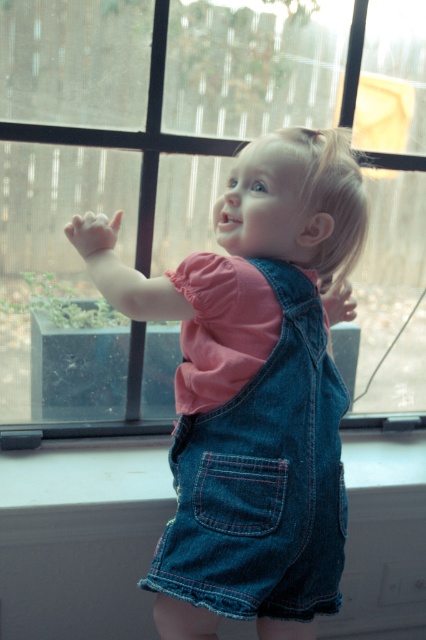
Between clear glass window at center and denim jacket at center, which one appears on the right side from the viewer's perspective?

clear glass window at center is more to the right.

Based on the photo, which of these two, clear glass window at center or denim jacket at center, stands taller?

Standing taller between the two is clear glass window at center.

Which is in front, point (423, 179) or point (244, 300)?

Point (244, 300) is in front.

Find the location of a particular element. Image resolution: width=426 pixels, height=640 pixels. clear glass window at center is located at coordinates (204, 129).

Who is positioned more to the right, denim overalls at center or denim jacket at center?

From the viewer's perspective, denim jacket at center appears more on the right side.

Can you confirm if denim overalls at center is smaller than denim jacket at center?

No, denim overalls at center is not smaller than denim jacket at center.

Between point (189, 454) and point (255, 472), which one is positioned in front?

Positioned in front is point (255, 472).

The height and width of the screenshot is (640, 426). I want to click on denim overalls at center, so click(x=252, y=388).

Measure the distance from clear glass window at center to denim overalls at center.

19.29 inches

Is clear glass window at center further to the viewer compared to denim overalls at center?

Yes, it is.

Who is more forward, [411,145] or [242,211]?

Point [242,211] is in front.

The height and width of the screenshot is (640, 426). Find the location of `clear glass window at center`. clear glass window at center is located at coordinates (204, 129).